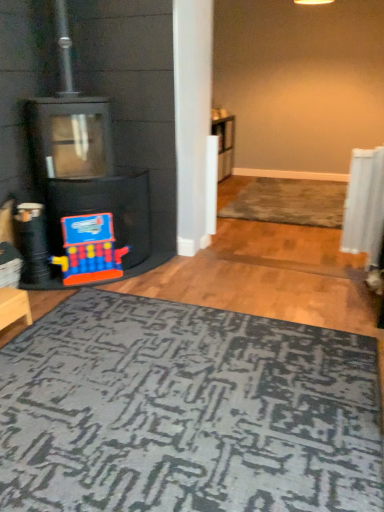
Question: From the image's perspective, relative to matte plastic toy at lower left, is black matte fireplace at left above or below?

Choices:
 (A) below
 (B) above

Answer: (B)

Question: Does point (130, 186) appear closer or farther from the camera than point (92, 253)?

Choices:
 (A) closer
 (B) farther

Answer: (B)

Question: Considering the real-world distances, which object is farthest from the matte plastic toy at lower left?

Choices:
 (A) wooden stool at lower left
 (B) rug with textured pattern at center
 (C) black matte fireplace at left
 (D) dark gray textured rug at lower center

Answer: (B)

Question: Which is farther from the black matte fireplace at left?

Choices:
 (A) dark gray textured rug at lower center
 (B) matte plastic toy at lower left
 (C) wooden stool at lower left
 (D) rug with textured pattern at center

Answer: (D)